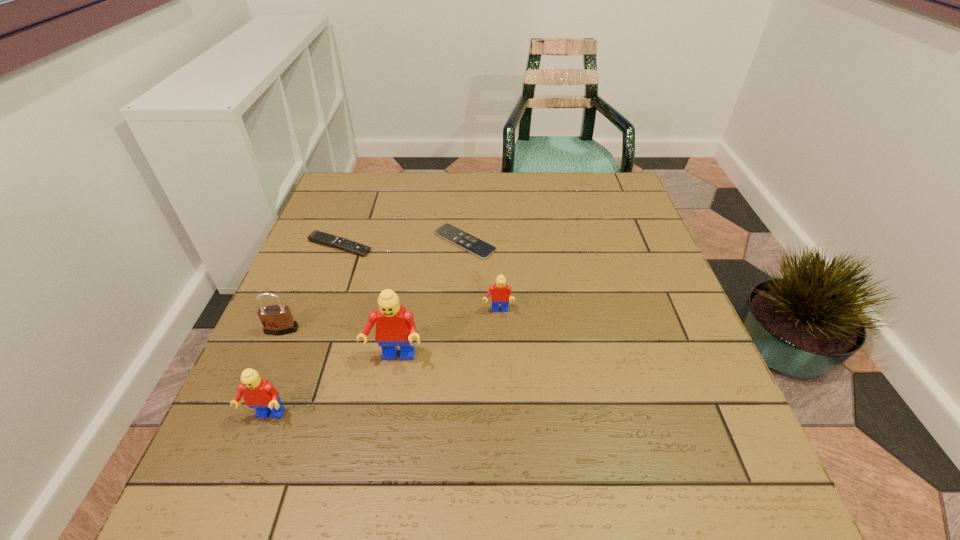
Find the location of `the leftmost Lego`. the leftmost Lego is located at coordinates (258, 393).

The width and height of the screenshot is (960, 540). In order to click on the nearest object in this screenshot , I will do `click(258, 393)`.

Locate an element on the screen. the tallest object is located at coordinates (395, 326).

The image size is (960, 540). I want to click on the second nearest object, so click(x=395, y=326).

Identify the location of the shortest Lego. This screenshot has height=540, width=960. (500, 293).

Find the location of a particular element. This screenshot has width=960, height=540. the farthest Lego is located at coordinates (500, 293).

You are a GUI agent. You are given a task and a screenshot of the screen. Output one action in this format:
    pyautogui.click(x=<x>, y=<y>)
    Task: Click on the taller remote control
    
    Given the screenshot: What is the action you would take?
    pyautogui.click(x=322, y=238)

Locate an element on the screen. This screenshot has width=960, height=540. the left remote control is located at coordinates (322, 238).

The height and width of the screenshot is (540, 960). I want to click on the shortest object, so click(x=469, y=243).

Where is `the right remote control`? The height and width of the screenshot is (540, 960). the right remote control is located at coordinates (469, 243).